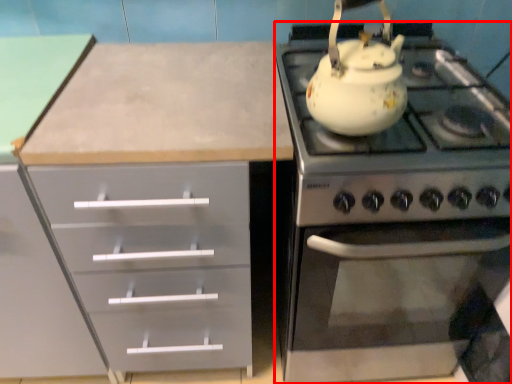
Question: From the image's perspective, where is appliance (annotated by the red box) located relative to kettle?

Choices:
 (A) below
 (B) above

Answer: (A)